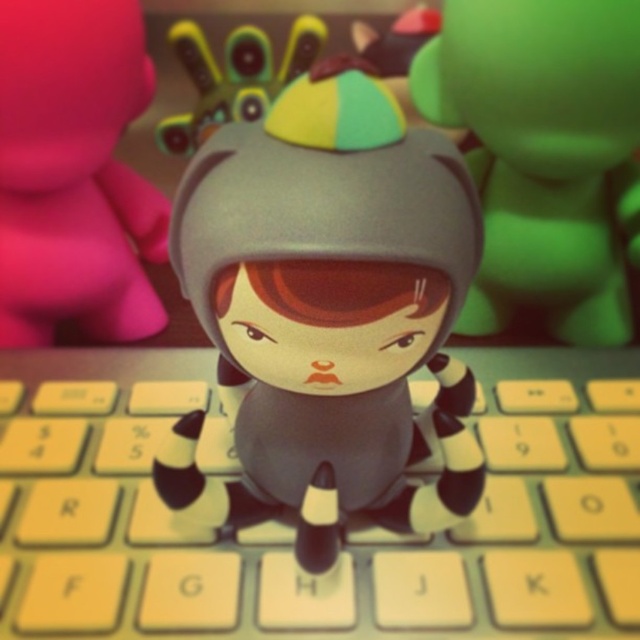
Question: Can you confirm if matte black toy at center is thinner than matte gray helmet at center?

Choices:
 (A) yes
 (B) no

Answer: (B)

Question: Does matte gray helmet at center have a smaller size compared to rubberized yellow and green toy at upper center?

Choices:
 (A) yes
 (B) no

Answer: (B)

Question: Among these points, which one is farthest from the camera?

Choices:
 (A) (112, 278)
 (B) (612, 8)

Answer: (A)

Question: Is yellow plastic keyboard at center smaller than matte pink toy at upper left?

Choices:
 (A) no
 (B) yes

Answer: (A)

Question: Which is nearer to the matte pink toy at upper left?

Choices:
 (A) matte black toy at center
 (B) matte gray helmet at center
 (C) yellow plastic keyboard at center

Answer: (C)

Question: Which point is farther to the camera?

Choices:
 (A) rubberized yellow and green toy at upper center
 (B) matte gray helmet at center
 (C) matte black toy at center
 (D) yellow plastic keyboard at center

Answer: (A)